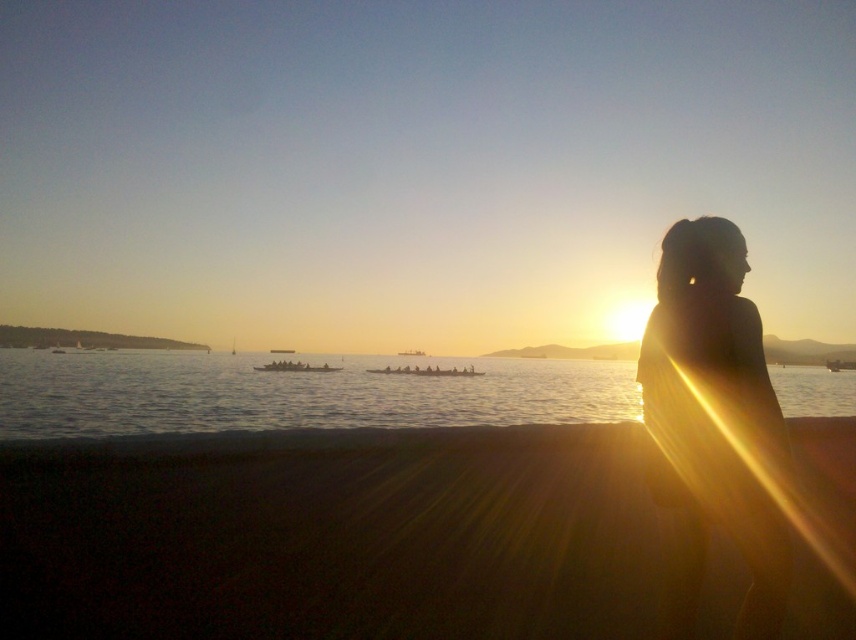
Is silvery water at center smaller than silhouette hair at right?

No.

Is silvery water at center shorter than silhouette hair at right?

Incorrect, silvery water at center's height does not fall short of silhouette hair at right's.

Does point (821, 408) come farther from viewer compared to point (764, 529)?

Yes, it is behind point (764, 529).

Image resolution: width=856 pixels, height=640 pixels. Find the location of `silvery water at center`. silvery water at center is located at coordinates (292, 394).

Can you confirm if dark sand at lower center is positioned to the left of silvery water at center?

Indeed, dark sand at lower center is positioned on the left side of silvery water at center.

Is dark sand at lower center smaller than silvery water at center?

Yes, dark sand at lower center is smaller than silvery water at center.

Does point (370, 541) come farther from viewer compared to point (397, 396)?

No.

What are the coordinates of `dark sand at lower center` in the screenshot? It's located at (331, 536).

Between dark sand at lower center and silhouette hair at right, which one appears on the left side from the viewer's perspective?

silhouette hair at right is more to the left.

Is dark sand at lower center wider than silhouette hair at right?

Yes, dark sand at lower center is wider than silhouette hair at right.

Where is `dark sand at lower center`? The image size is (856, 640). dark sand at lower center is located at coordinates (331, 536).